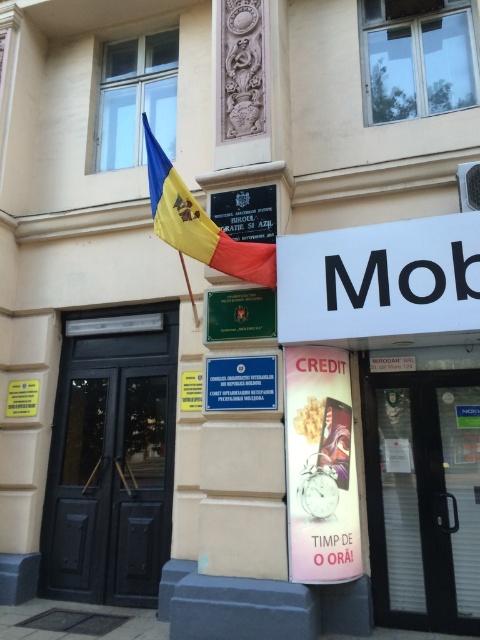
You are a delivery person approaching the building and need to locate the entrance. Which object, the black wooden door at left or the polyester flag at upper center, is located below the other?

The black wooden door at left is positioned under the polyester flag at upper center, so the door is below the flag.

You are a delivery person arriving at the building and need to locate the entrance. You see the black wooden door at left and the green matte sign at center. Which object is larger and therefore more likely to be the entrance?

The black wooden door at left is bigger than the green matte sign at center, so it is more likely to be the entrance.